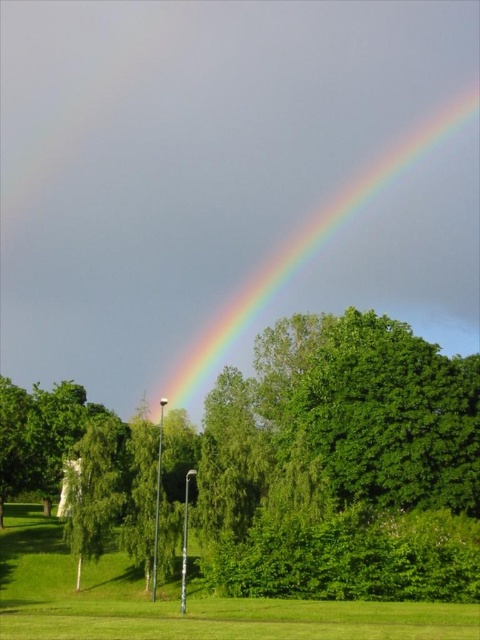
Question: Which of these objects is positioned farthest from the green leafy tree at center?

Choices:
 (A) rainbow at upper center
 (B) green grass at lower center

Answer: (A)

Question: Is green leafy tree at center below rainbow at upper center?

Choices:
 (A) yes
 (B) no

Answer: (A)

Question: Where is green leafy tree at center located in relation to rainbow at upper center in the image?

Choices:
 (A) left
 (B) right

Answer: (A)

Question: Considering the real-world distances, which object is closest to the green grass at lower center?

Choices:
 (A) rainbow at upper center
 (B) green leafy tree at center

Answer: (B)

Question: Which is nearer to the green grass at lower center?

Choices:
 (A) rainbow at upper center
 (B) green leafy tree at center

Answer: (B)

Question: Is green grass at lower center closer to camera compared to rainbow at upper center?

Choices:
 (A) no
 (B) yes

Answer: (B)